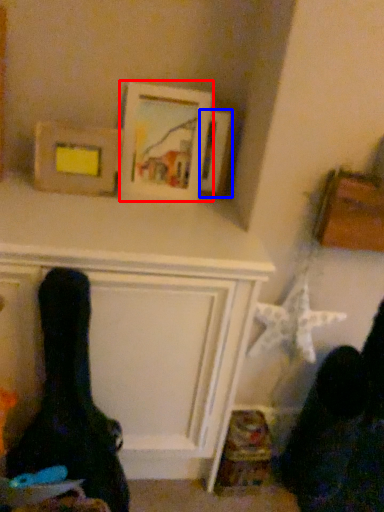
Question: Which object appears closest to the camera in this image, picture frame (highlighted by a red box) or picture frame (highlighted by a blue box)?

Choices:
 (A) picture frame
 (B) picture frame

Answer: (A)